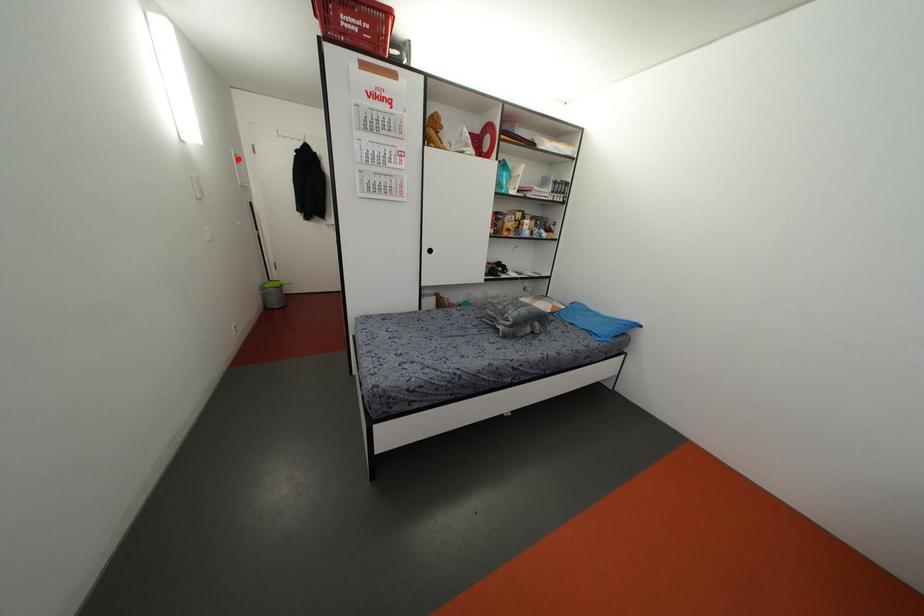
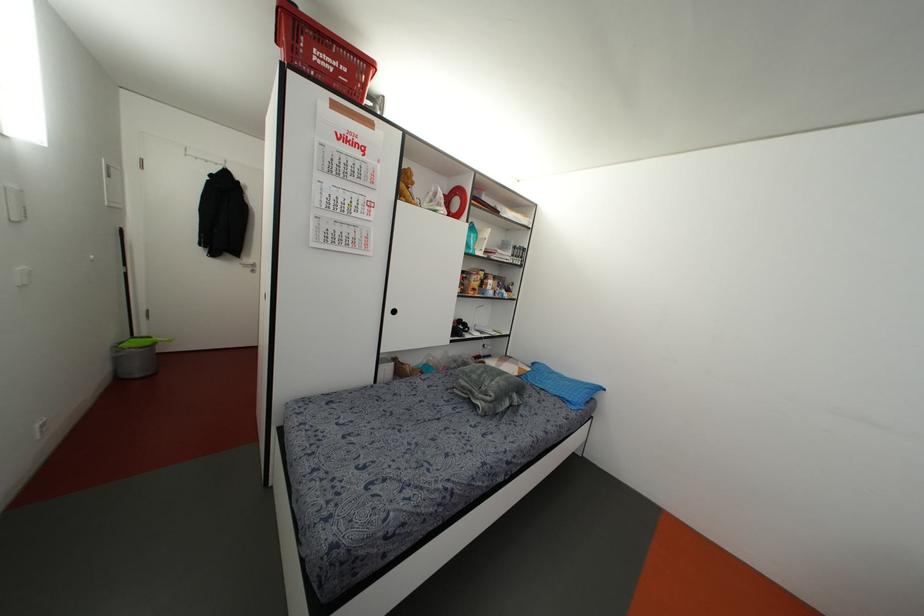
In the second image, find the point that corresponds to the highlighted location in the first image.

(112, 172)